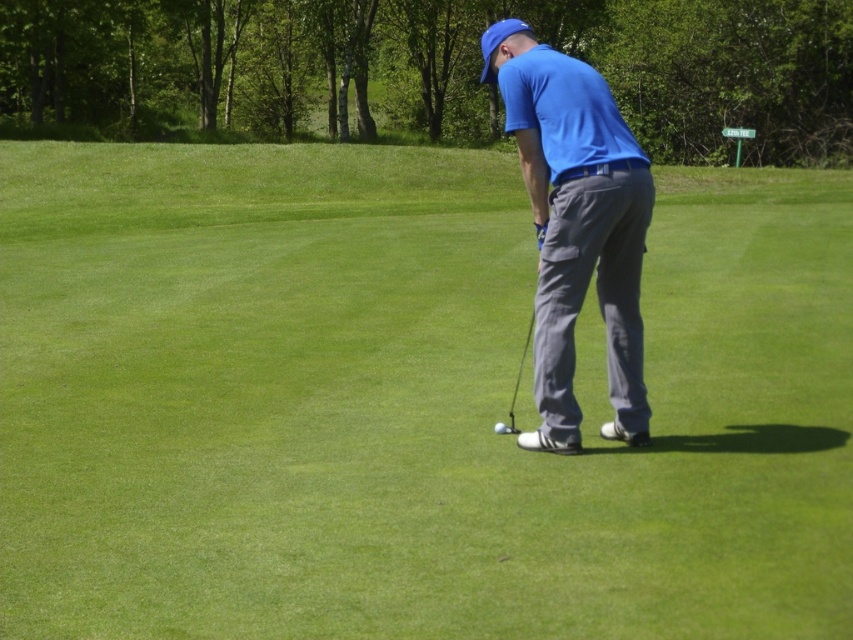
You are a golfer preparing to putt. You notice the metallic silver golf club at center and the white matte golf ball at center. Which object is taller?

The metallic silver golf club at center is taller than the white matte golf ball at center.

You are a golfer standing on the green preparing to putt. You notice the metallic silver golf club at center and the white matte golf ball at center. Which object is positioned higher relative to the other?

The metallic silver golf club at center is located above the white matte golf ball at center, so it is positioned higher.